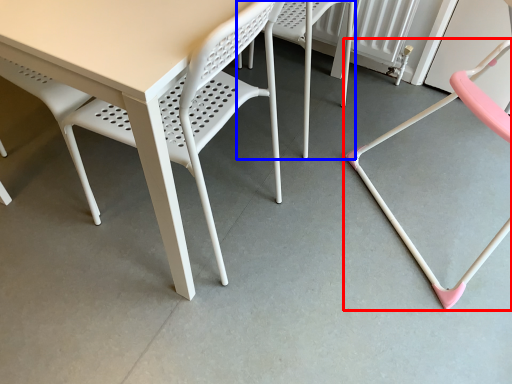
Question: Which object appears closest to the camera in this image, chair (highlighted by a red box) or chair (highlighted by a blue box)?

Choices:
 (A) chair
 (B) chair

Answer: (A)